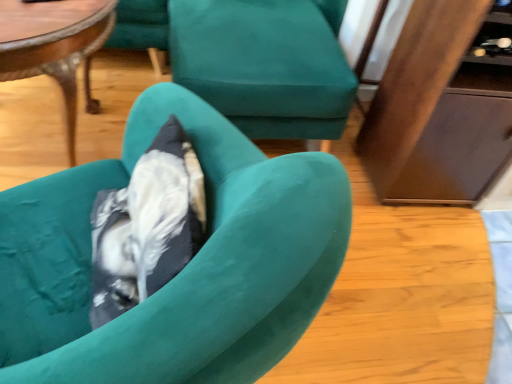
Question: In terms of width, does teal fabric chair at center, which is the 2th chair in front-to-back order, look wider or thinner when compared to velvet teal armchair at center, acting as the 2th chair starting from the back?

Choices:
 (A) wide
 (B) thin

Answer: (A)

Question: Considering the positions of teal fabric chair at center, arranged as the first chair when viewed from the top, and velvet teal armchair at center, which ranks as the 2th chair in top-to-bottom order, in the image, is teal fabric chair at center, arranged as the first chair when viewed from the top, taller or shorter than velvet teal armchair at center, which ranks as the 2th chair in top-to-bottom order,?

Choices:
 (A) tall
 (B) short

Answer: (A)

Question: Estimate the real-world distances between objects in this image. Which object is farther from the velvet teal armchair at center, positioned as the first chair in bottom-to-top order?

Choices:
 (A) wooden polished coffee table at upper left
 (B) teal fabric chair at center, which is the 2th chair in bottom-to-top order
 (C) wooden dresser at right

Answer: (C)

Question: Considering the real-world distances, which object is closest to the wooden polished coffee table at upper left?

Choices:
 (A) velvet teal armchair at center, acting as the 2th chair starting from the back
 (B) teal fabric chair at center, which is the 2th chair in front-to-back order
 (C) wooden dresser at right

Answer: (A)